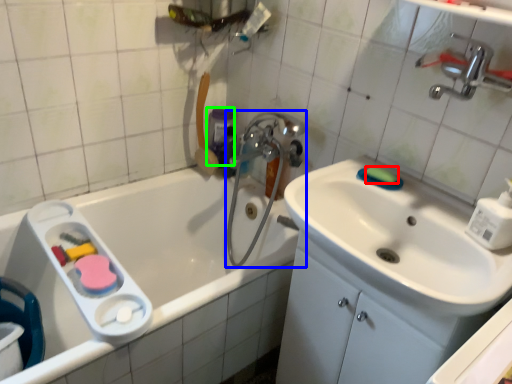
Question: Estimate the real-world distances between objects in this image. Which object is farther from soap (highlighted by a red box), plumbing fixture (highlighted by a blue box) or mouthwash (highlighted by a green box)?

Choices:
 (A) plumbing fixture
 (B) mouthwash

Answer: (B)